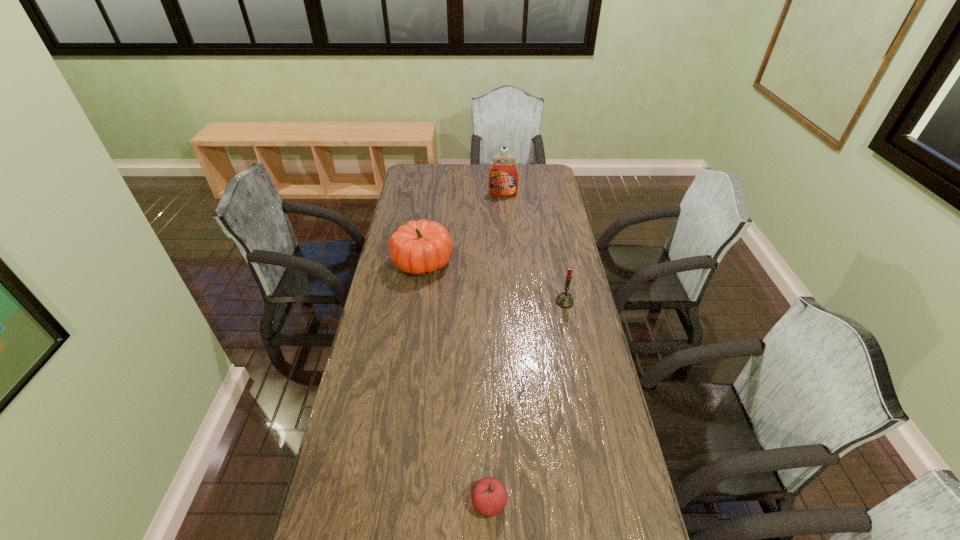
This screenshot has width=960, height=540. I want to click on vacant region located on the front of the third farthest object, so click(x=570, y=329).

Image resolution: width=960 pixels, height=540 pixels. Find the location of `vacant region located 0.210m on the right of the shortest object`. vacant region located 0.210m on the right of the shortest object is located at coordinates (591, 502).

The height and width of the screenshot is (540, 960). I want to click on object located at the left edge, so click(x=421, y=246).

Identify the location of object located at the right edge. (564, 300).

Identify the location of vacant space at the left edge of the desktop. The width and height of the screenshot is (960, 540). (387, 289).

Identify the location of vacant space at the right edge. The width and height of the screenshot is (960, 540). (580, 458).

The width and height of the screenshot is (960, 540). Find the location of `blank space at the far left corner of the desktop`. blank space at the far left corner of the desktop is located at coordinates (430, 167).

This screenshot has height=540, width=960. In the image, there is a desktop. In order to click on vacant space at the far right corner in this screenshot , I will do `click(553, 186)`.

Where is `vacant area between the second nearest object and the third nearest object`? Image resolution: width=960 pixels, height=540 pixels. vacant area between the second nearest object and the third nearest object is located at coordinates (493, 282).

At what (x,y) coordinates should I click in order to perform the action: click on unoccupied position between the rightmost object and the detergent. Please return your answer as a coordinate pair (x, y). The width and height of the screenshot is (960, 540). Looking at the image, I should click on (534, 248).